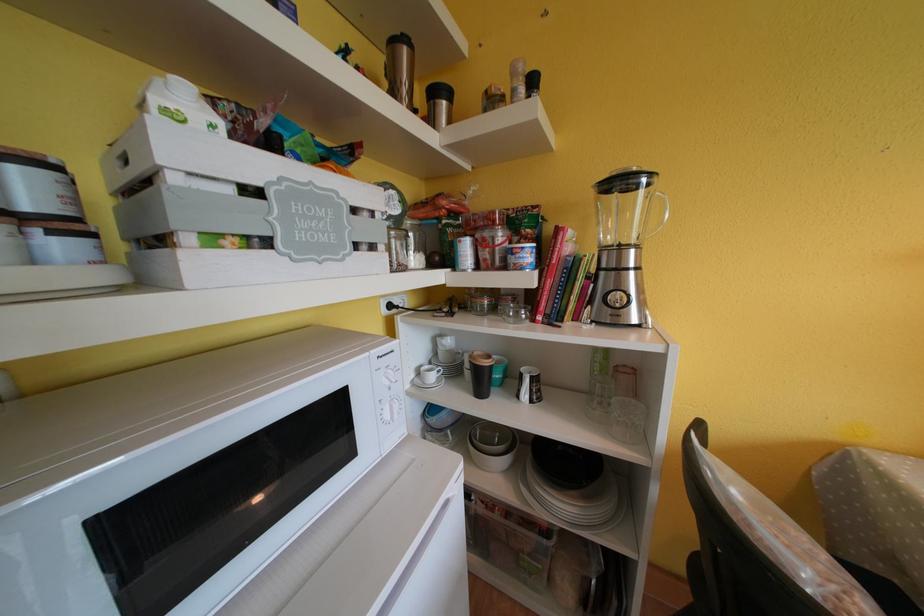
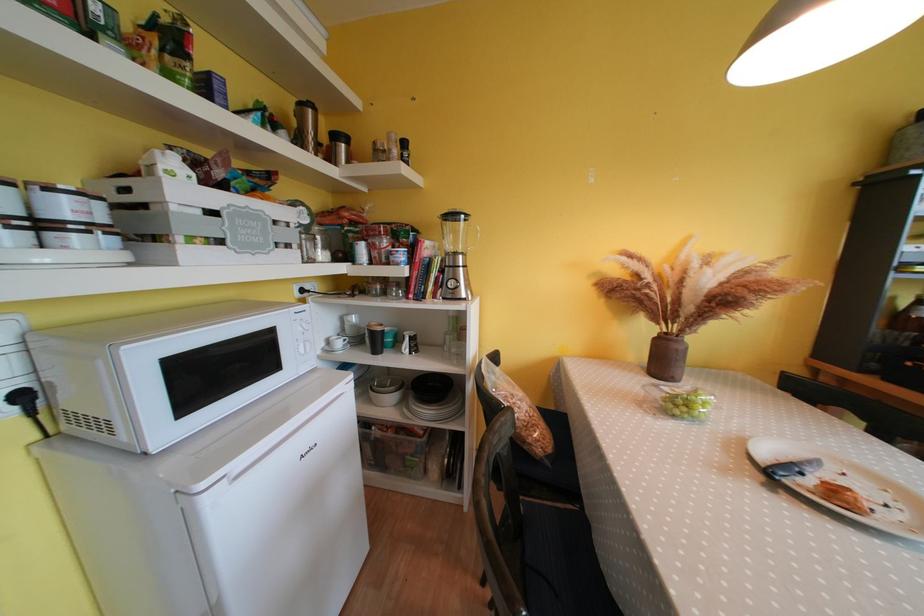
In the second image, find the point that corresponds to pixel 439 381 in the first image.

(345, 347)